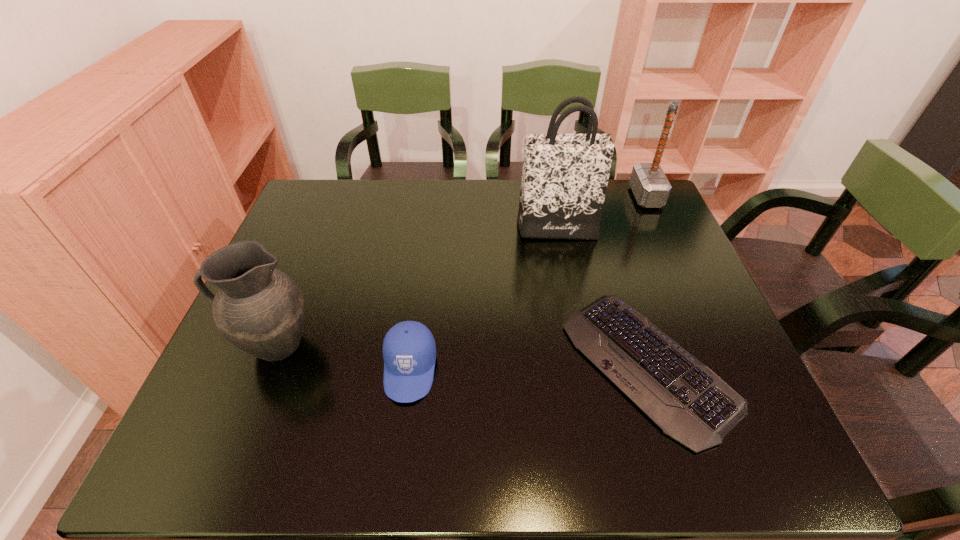
Identify the location of vacant area located on the striking surface of the hammer. The height and width of the screenshot is (540, 960). (611, 197).

Image resolution: width=960 pixels, height=540 pixels. I want to click on vacant space located 0.080m on the front-facing side of the cap, so click(400, 443).

Find the location of a particular element. vacant point located on the back of the computer keyboard is located at coordinates (597, 207).

I want to click on shopping bag that is positioned at the far edge, so click(x=564, y=180).

Where is `hammer that is at the far edge`? hammer that is at the far edge is located at coordinates (650, 186).

This screenshot has height=540, width=960. Find the location of `object located at the near edge`. object located at the near edge is located at coordinates (690, 403).

Locate an element on the screen. object present at the left edge is located at coordinates (259, 309).

Find the location of a particular element. This screenshot has height=540, width=960. hammer at the right edge is located at coordinates (650, 186).

In order to click on computer keyboard located in the right edge section of the desktop in this screenshot , I will do `click(690, 403)`.

Locate an element on the screen. The image size is (960, 540). object located in the far right corner section of the desktop is located at coordinates (650, 186).